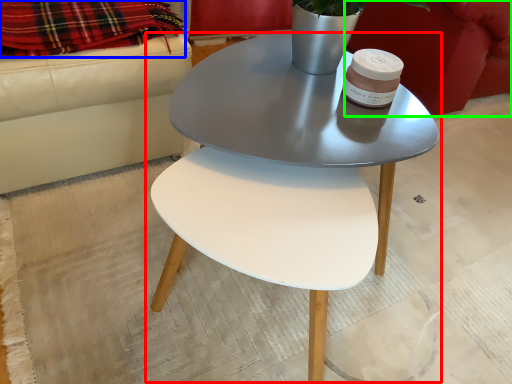
Question: Based on their relative distances, which object is farther from coffee table (highlighted by a red box)? Choose from blanket (highlighted by a blue box) and armchair (highlighted by a green box).

Choices:
 (A) blanket
 (B) armchair

Answer: (B)